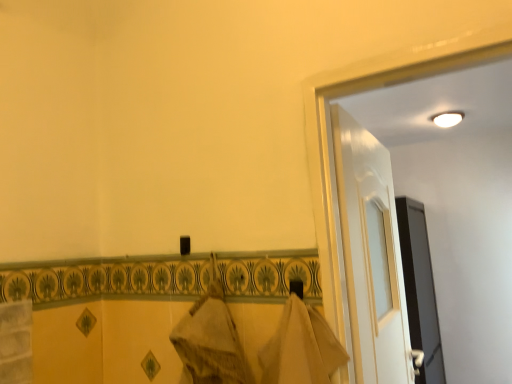
Question: Considering the relative positions of white glossy light at upper right and black glossy screen door at right in the image provided, is white glossy light at upper right behind black glossy screen door at right?

Choices:
 (A) yes
 (B) no

Answer: (A)

Question: Would you say white glossy light at upper right is a long distance from black glossy screen door at right?

Choices:
 (A) no
 (B) yes

Answer: (B)

Question: Is white glossy light at upper right to the right of black glossy screen door at right from the viewer's perspective?

Choices:
 (A) no
 (B) yes

Answer: (B)

Question: From a real-world perspective, is white glossy light at upper right over black glossy screen door at right?

Choices:
 (A) yes
 (B) no

Answer: (A)

Question: Can you confirm if white glossy light at upper right is smaller than black glossy screen door at right?

Choices:
 (A) yes
 (B) no

Answer: (A)

Question: Is the depth of white glossy light at upper right less than that of black glossy screen door at right?

Choices:
 (A) no
 (B) yes

Answer: (A)

Question: Can we say black glossy screen door at right lies outside white glossy light at upper right?

Choices:
 (A) yes
 (B) no

Answer: (A)

Question: Is black glossy screen door at right with white glossy light at upper right?

Choices:
 (A) no
 (B) yes

Answer: (A)

Question: Does black glossy screen door at right have a smaller size compared to white glossy light at upper right?

Choices:
 (A) yes
 (B) no

Answer: (B)

Question: Can white glossy light at upper right be found inside black glossy screen door at right?

Choices:
 (A) yes
 (B) no

Answer: (B)

Question: Considering the relative sizes of black glossy screen door at right and white glossy light at upper right in the image provided, is black glossy screen door at right thinner than white glossy light at upper right?

Choices:
 (A) yes
 (B) no

Answer: (B)

Question: Would you say black glossy screen door at right is a long distance from white glossy light at upper right?

Choices:
 (A) no
 (B) yes

Answer: (B)

Question: From a real-world perspective, is white glossy door at upper right below white glossy light at upper right?

Choices:
 (A) yes
 (B) no

Answer: (A)